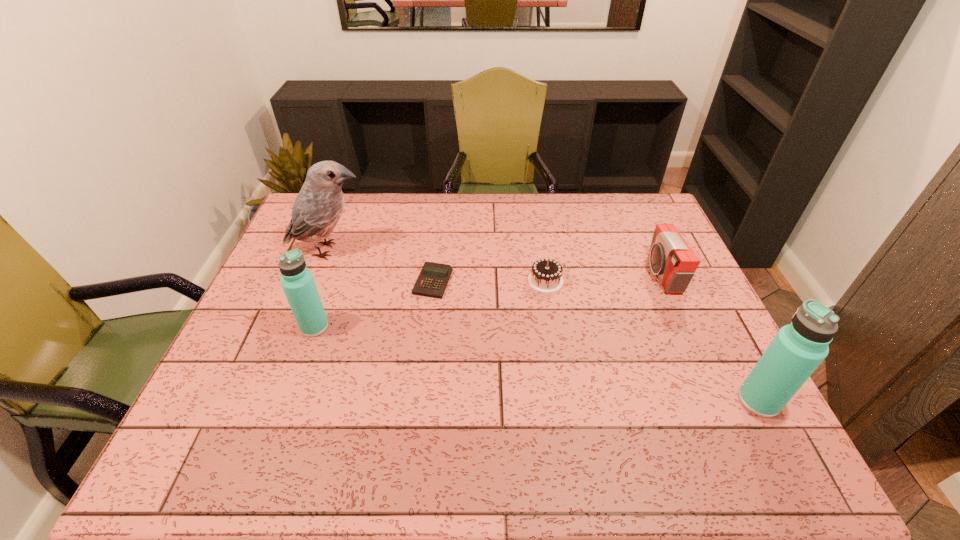
The height and width of the screenshot is (540, 960). In order to click on thermos bottle at the left edge in this screenshot , I will do `click(298, 284)`.

Image resolution: width=960 pixels, height=540 pixels. Find the location of `parrot present at the left edge`. parrot present at the left edge is located at coordinates (318, 207).

Find the location of a particular element. This screenshot has height=540, width=960. thermos bottle located at the right edge is located at coordinates (796, 351).

Where is `camera at the right edge`? The image size is (960, 540). camera at the right edge is located at coordinates (671, 258).

Find the location of a particular element. object at the near right corner is located at coordinates (796, 351).

In the image, there is a desktop. Identify the location of blank space at the far edge. (431, 225).

At what (x,y) coordinates should I click in order to perform the action: click on free space at the near edge. Please return your answer as a coordinate pair (x, y). Looking at the image, I should click on (463, 399).

Where is `free space at the left edge of the desktop`? free space at the left edge of the desktop is located at coordinates (216, 383).

You are a GUI agent. You are given a task and a screenshot of the screen. Output one action in this format:
    pyautogui.click(x=<x>, y=<y>)
    Task: Click on the vacant point at the right edge
    The height and width of the screenshot is (540, 960).
    Given the screenshot: What is the action you would take?
    pyautogui.click(x=697, y=350)

Image resolution: width=960 pixels, height=540 pixels. In the image, there is a desktop. Identify the location of free space at the far right corner. (654, 207).